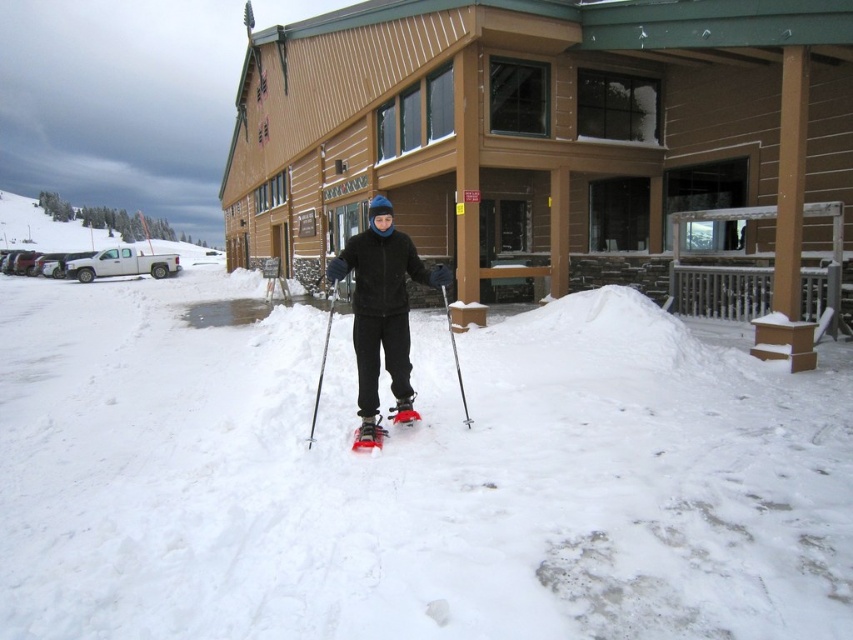
Question: Which of the following is the closest to the observer?

Choices:
 (A) silver metallic ski pole at center
 (B) red rubber snowshoe at center
 (C) red rubber ski at center
 (D) matte black ski boots at center

Answer: (D)

Question: Is red rubber ski at center below red matte snowshoe at center?

Choices:
 (A) no
 (B) yes

Answer: (B)

Question: In this image, where is matte black ski boots at center located relative to red matte snowshoe at center?

Choices:
 (A) left
 (B) right

Answer: (A)

Question: Observing the image, what is the correct spatial positioning of metallic silver ski pole at center in reference to red matte snowshoe at center?

Choices:
 (A) left
 (B) right

Answer: (A)

Question: Which of the following is the closest to the observer?

Choices:
 (A) matte black ski boots at center
 (B) red rubber snowshoe at center

Answer: (A)

Question: Estimate the real-world distances between objects in this image. Which object is farther from the silver metallic ski pole at center?

Choices:
 (A) red matte snowshoe at center
 (B) matte black ski boots at center
 (C) red rubber snowshoe at center
 (D) metallic silver ski pole at center

Answer: (D)